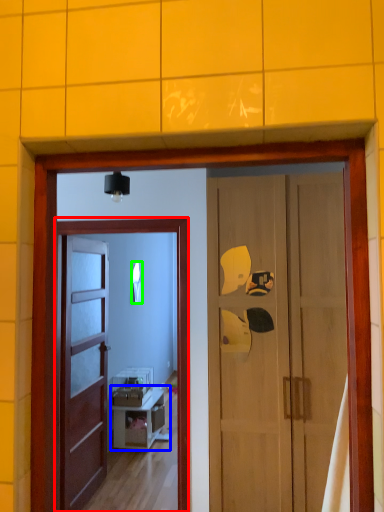
Question: Which is nearer to the screen door (highlighted by a red box)? cabinetry (highlighted by a blue box) or mirror (highlighted by a green box).

Choices:
 (A) cabinetry
 (B) mirror

Answer: (B)